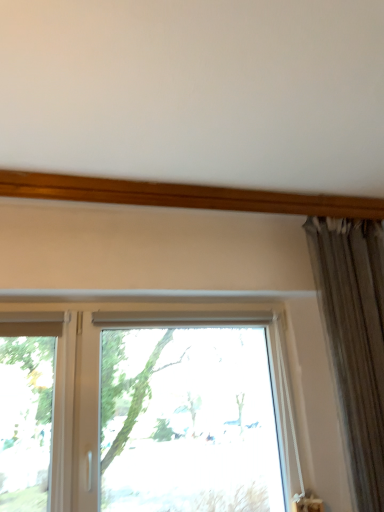
Describe the element at coordinates (355, 340) in the screenshot. I see `satin gray curtain at right` at that location.

I want to click on satin gray curtain at right, so click(355, 340).

Image resolution: width=384 pixels, height=512 pixels. In order to click on satin gray curtain at right in this screenshot , I will do click(x=355, y=340).